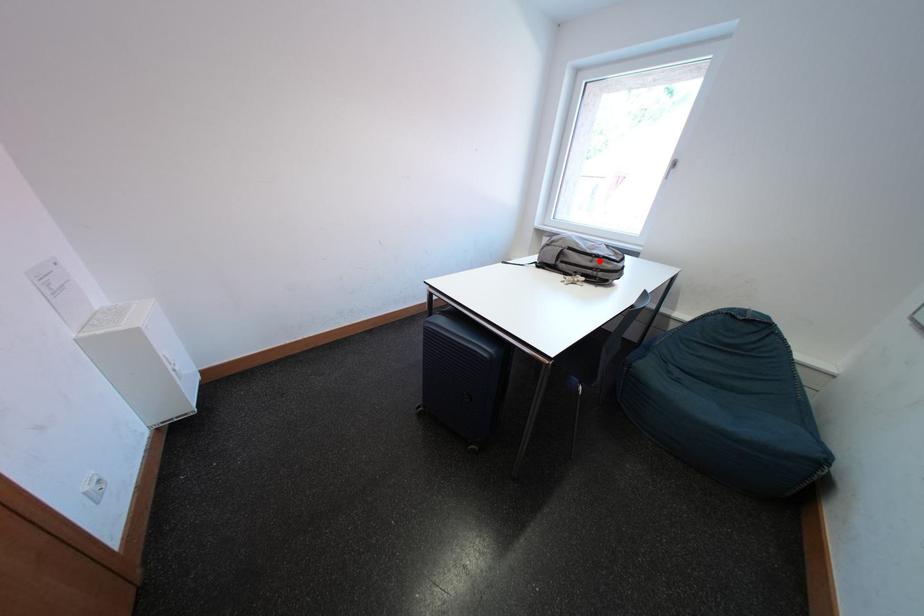
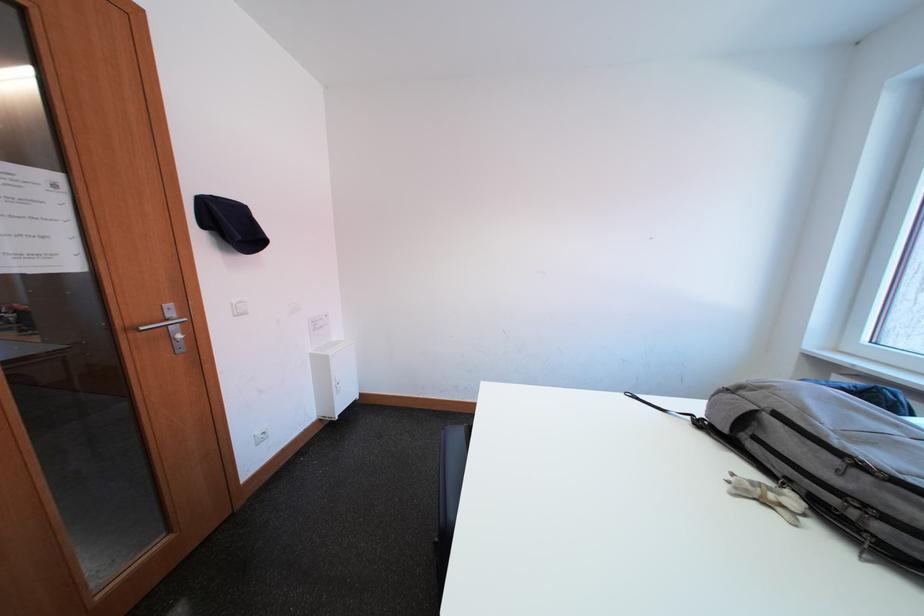
Question: I am providing you with two images of the same scene from different viewpoints. A red point is shown in image1. For the corresponding object point in image2, is it positioned nearer or farther from the camera?

Choices:
 (A) Nearer
 (B) Farther

Answer: (B)